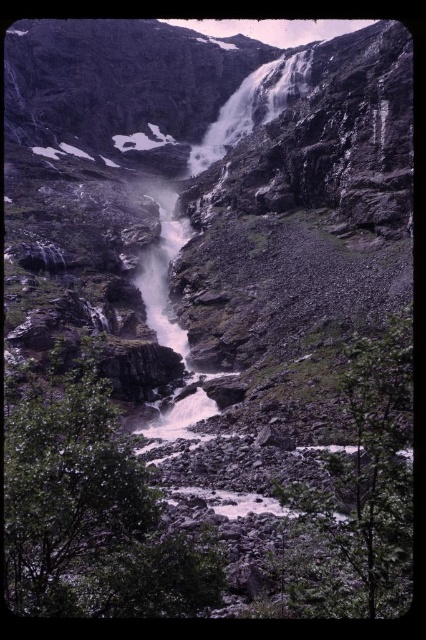
Question: Does green leafy tree at center appear over green leafy tree at lower right?

Choices:
 (A) no
 (B) yes

Answer: (A)

Question: Is green leafy tree at center in front of green leafy tree at lower right?

Choices:
 (A) yes
 (B) no

Answer: (B)

Question: Is green leafy tree at center further to camera compared to green leafy tree at lower right?

Choices:
 (A) no
 (B) yes

Answer: (B)

Question: Which point is closer to the camera taking this photo?

Choices:
 (A) (150, 484)
 (B) (313, 513)

Answer: (B)

Question: Among these objects, which one is nearest to the camera?

Choices:
 (A) green leafy tree at lower right
 (B) green leafy tree at center

Answer: (A)